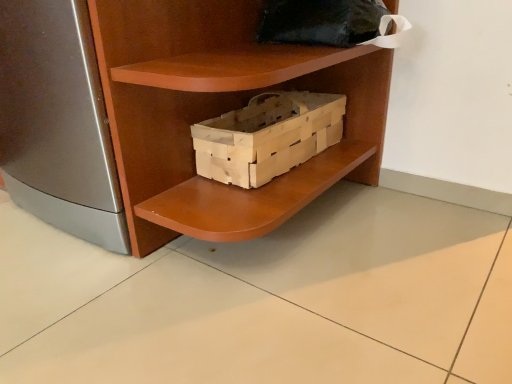
Question: From a real-world perspective, is wooden crate at center on top of black fabric pillow at upper center?

Choices:
 (A) no
 (B) yes

Answer: (A)

Question: Considering the relative sizes of wooden crate at center and black fabric pillow at upper center in the image provided, is wooden crate at center wider than black fabric pillow at upper center?

Choices:
 (A) yes
 (B) no

Answer: (B)

Question: From a real-world perspective, does wooden crate at center sit lower than black fabric pillow at upper center?

Choices:
 (A) no
 (B) yes

Answer: (B)

Question: From the image's perspective, would you say wooden crate at center is positioned over black fabric pillow at upper center?

Choices:
 (A) no
 (B) yes

Answer: (A)

Question: Can you confirm if wooden crate at center is bigger than black fabric pillow at upper center?

Choices:
 (A) yes
 (B) no

Answer: (A)

Question: From the image's perspective, is wooden crate at center above or below black fabric pillow at upper center?

Choices:
 (A) above
 (B) below

Answer: (B)

Question: Do you think wooden crate at center is within black fabric pillow at upper center, or outside of it?

Choices:
 (A) outside
 (B) inside

Answer: (A)

Question: From a real-world perspective, is wooden crate at center above or below black fabric pillow at upper center?

Choices:
 (A) below
 (B) above

Answer: (A)

Question: Would you say wooden crate at center is to the left or to the right of black fabric pillow at upper center in the picture?

Choices:
 (A) right
 (B) left

Answer: (B)

Question: In the image, is black fabric pillow at upper center positioned in front of or behind wooden crate at center?

Choices:
 (A) front
 (B) behind

Answer: (B)

Question: Considering the relative positions of black fabric pillow at upper center and wooden crate at center in the image provided, is black fabric pillow at upper center to the left or to the right of wooden crate at center?

Choices:
 (A) right
 (B) left

Answer: (A)

Question: Is point (374, 26) positioned closer to the camera than point (202, 19)?

Choices:
 (A) closer
 (B) farther

Answer: (B)

Question: Looking at the image, does black fabric pillow at upper center seem bigger or smaller compared to wooden crate at center?

Choices:
 (A) small
 (B) big

Answer: (A)

Question: Based on their positions, is wooden crate at center located to the left or right of wooden crate at center?

Choices:
 (A) right
 (B) left

Answer: (A)

Question: From the image's perspective, relative to wooden crate at center, is wooden crate at center above or below?

Choices:
 (A) above
 (B) below

Answer: (B)